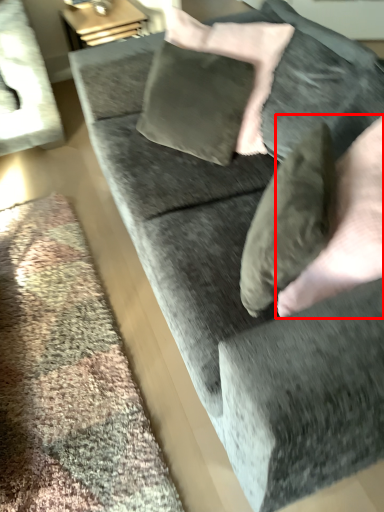
Question: From the image's perspective, what is the correct spatial relationship of hand (annotated by the red box) in relation to pillow?

Choices:
 (A) below
 (B) above

Answer: (A)